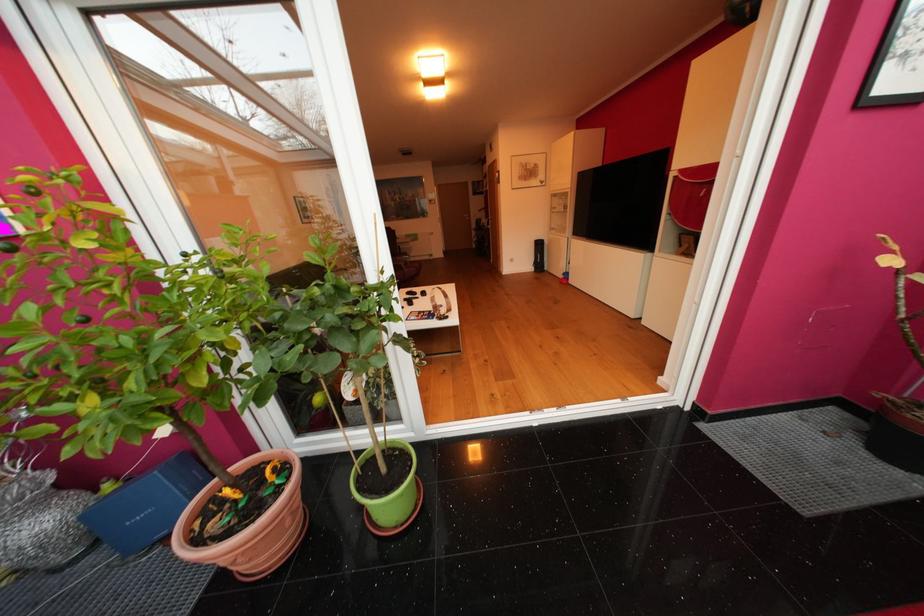
This screenshot has width=924, height=616. What are the coordinates of `blue closed laptop` in the screenshot? It's located at (147, 505).